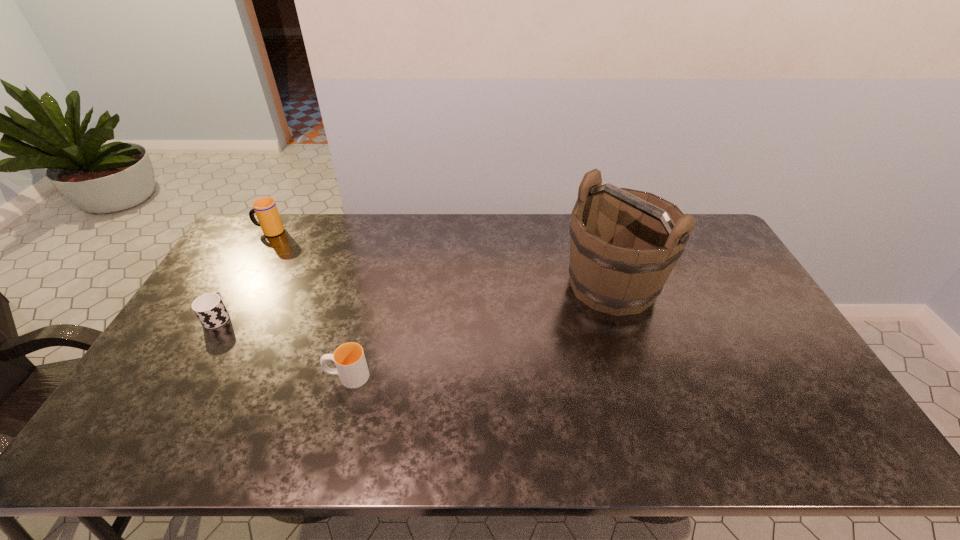
Identify the location of the rightmost object. The width and height of the screenshot is (960, 540). (x=624, y=243).

In order to click on the tallest object in this screenshot , I will do `click(624, 243)`.

Find the location of a particular element. The height and width of the screenshot is (540, 960). the second tallest object is located at coordinates (265, 208).

What are the coordinates of `the farthest cup` in the screenshot? It's located at (265, 208).

Where is `the second shortest object`? The image size is (960, 540). the second shortest object is located at coordinates pyautogui.click(x=349, y=358).

What are the coordinates of `the third object from left to right` in the screenshot? It's located at (349, 358).

Where is `the second farthest cup`? This screenshot has width=960, height=540. the second farthest cup is located at coordinates (209, 308).

This screenshot has width=960, height=540. Identify the location of the shortest cup. (209, 308).

Locate an element on the screen. vacant space located 0.200m on the back of the bucket is located at coordinates tap(591, 220).

Locate an element on the screen. This screenshot has height=540, width=960. free space located with the handle on the side of the third object from left to right is located at coordinates (204, 376).